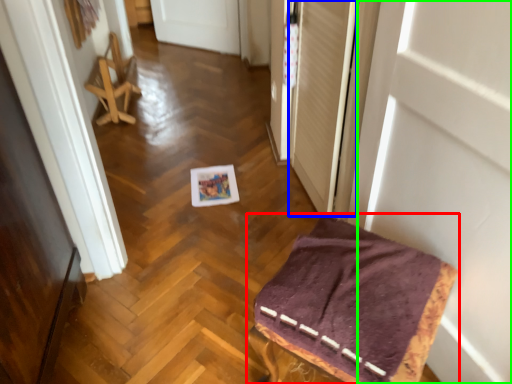
Question: Which is farther away from furniture (highlighted by a red box)? screen door (highlighted by a blue box) or door (highlighted by a green box)?

Choices:
 (A) screen door
 (B) door

Answer: (A)